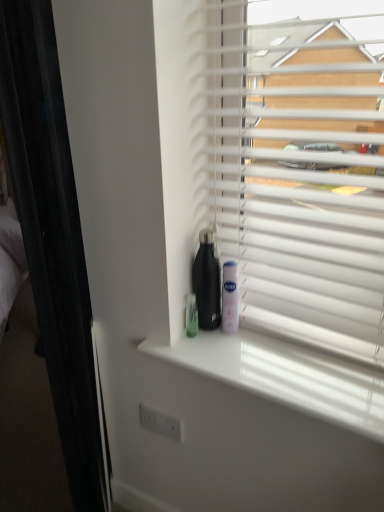
Locate an element on the screen. The width and height of the screenshot is (384, 512). vacant area in front of white plastic mouthwash at center is located at coordinates (236, 357).